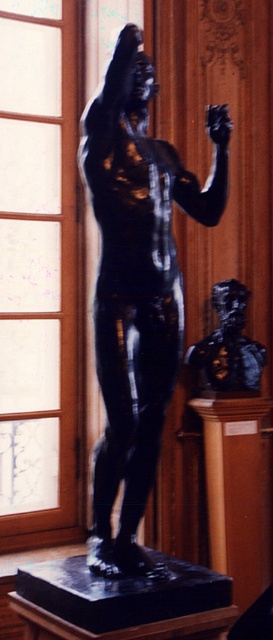
Question: Does black polished statue at center appear over black polished bust at center?

Choices:
 (A) no
 (B) yes

Answer: (B)

Question: Does black polished statue at center appear on the left side of black polished bust at center?

Choices:
 (A) yes
 (B) no

Answer: (A)

Question: Which point is farther from the camera taking this photo?

Choices:
 (A) (254, 344)
 (B) (120, 566)

Answer: (A)

Question: Which point is closer to the camera?

Choices:
 (A) (215, 390)
 (B) (104, 392)

Answer: (B)

Question: Is black polished statue at center closer to camera compared to black polished bust at center?

Choices:
 (A) yes
 (B) no

Answer: (A)